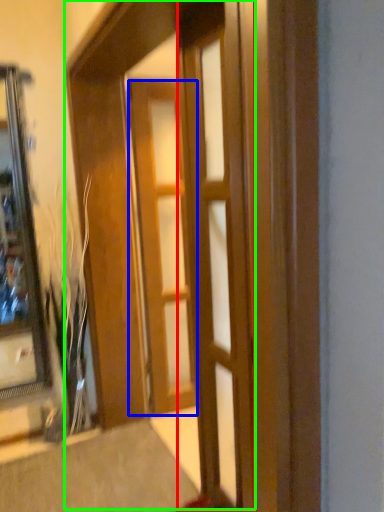
Question: Considering the real-world distances, which object is closest to door (highlighted by a red box)? door (highlighted by a blue box) or barn door (highlighted by a green box).

Choices:
 (A) door
 (B) barn door

Answer: (B)